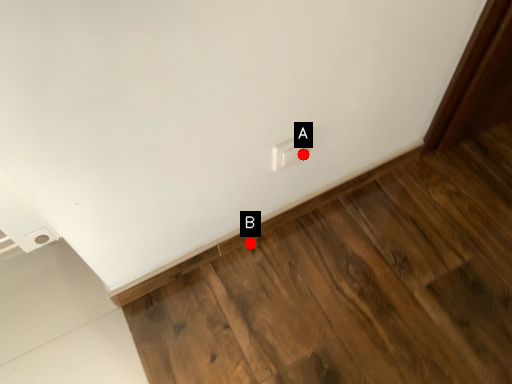
Question: Two points are circled on the image, labeled by A and B beside each circle. Among these points, which one is nearest to the camera?

Choices:
 (A) A is closer
 (B) B is closer

Answer: (A)